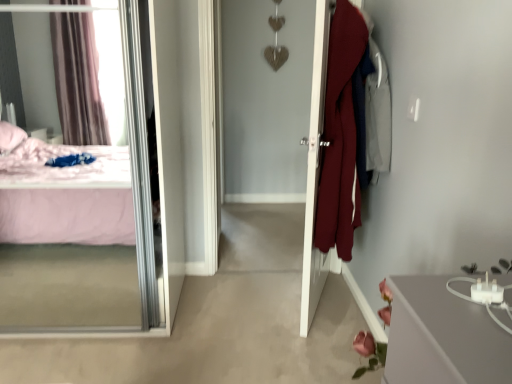
Find the location of a particular element. This screenshot has width=512, height=384. vacant space in transparent glass mirror at left (from a real-world perspective) is located at coordinates (75, 308).